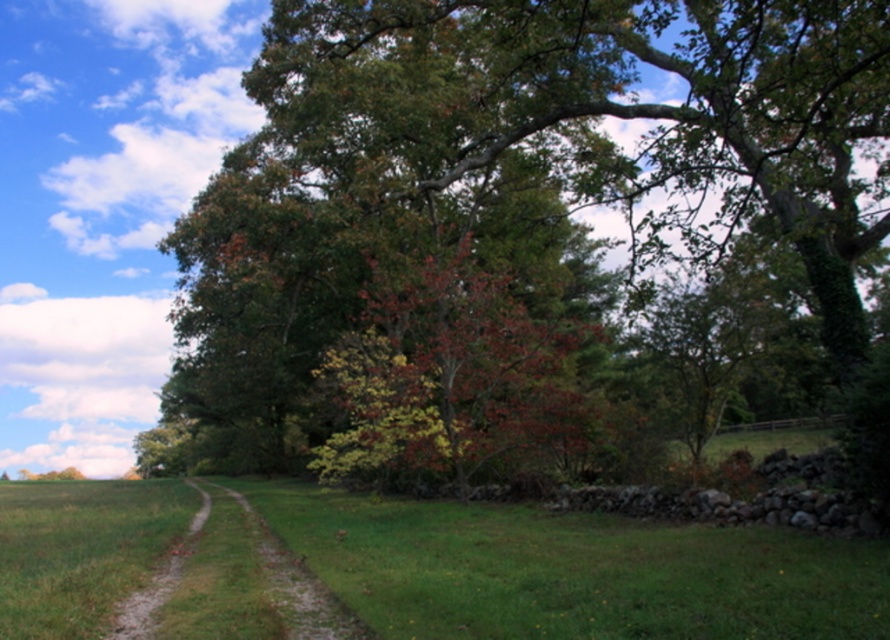
Based on the scene description, where is the green leafy tree at center located in terms of coordinates?

The green leafy tree at center is located at point (534, 195).